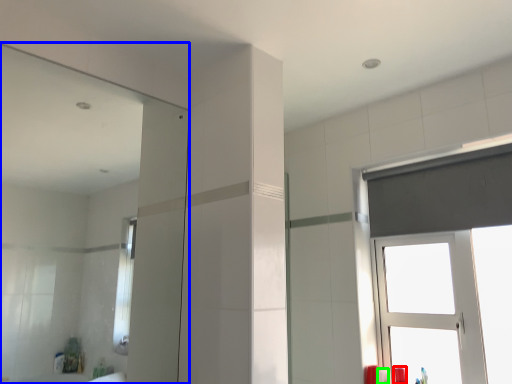
Question: Estimate the real-world distances between objects in this image. Which object is farther from toiletry (highlighted by a red box), mirror (highlighted by a blue box) or toiletry (highlighted by a green box)?

Choices:
 (A) mirror
 (B) toiletry

Answer: (A)